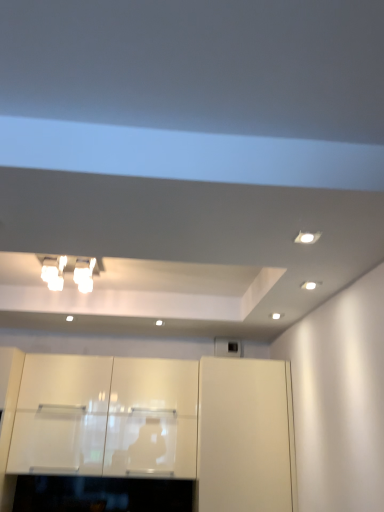
Question: Considering the relative sizes of white glossy light fixture at upper left and glossy white cabinets at center, which is the second cabinetry from left to right, in the image provided, is white glossy light fixture at upper left taller than glossy white cabinets at center, which is the second cabinetry from left to right,?

Choices:
 (A) no
 (B) yes

Answer: (A)

Question: From a real-world perspective, is white glossy light fixture at upper left over glossy white cabinets at center, which is the second cabinetry from left to right?

Choices:
 (A) no
 (B) yes

Answer: (B)

Question: Considering the relative sizes of white glossy light fixture at upper left and glossy white cabinets at center, which is counted as the second cabinetry, starting from the right, in the image provided, is white glossy light fixture at upper left shorter than glossy white cabinets at center, which is counted as the second cabinetry, starting from the right,?

Choices:
 (A) yes
 (B) no

Answer: (A)

Question: Are white glossy light fixture at upper left and glossy white cabinets at center, which is counted as the second cabinetry, starting from the right, located far from each other?

Choices:
 (A) yes
 (B) no

Answer: (A)

Question: Is white glossy light fixture at upper left thinner than glossy white cabinets at center, which is counted as the second cabinetry, starting from the right?

Choices:
 (A) yes
 (B) no

Answer: (B)

Question: Is white glossy cabinet at center, the third cabinetry positioned from the right, bigger or smaller than glossy white cabinets at center, which is the second cabinetry from left to right?

Choices:
 (A) big
 (B) small

Answer: (A)

Question: Which is correct: white glossy cabinet at center, the third cabinetry positioned from the right, is inside glossy white cabinets at center, which is counted as the second cabinetry, starting from the right, or outside of it?

Choices:
 (A) outside
 (B) inside

Answer: (A)

Question: Considering their positions, is white glossy cabinet at center, the third cabinetry positioned from the right, located in front of or behind glossy white cabinets at center, which is the second cabinetry from left to right?

Choices:
 (A) front
 (B) behind

Answer: (B)

Question: Considering the relative positions of white glossy cabinet at center, which is the 1th cabinetry from left to right, and glossy white cabinets at center, which is counted as the second cabinetry, starting from the right, in the image provided, is white glossy cabinet at center, which is the 1th cabinetry from left to right, to the left or to the right of glossy white cabinets at center, which is counted as the second cabinetry, starting from the right,?

Choices:
 (A) right
 (B) left

Answer: (B)

Question: From the image's perspective, is glossy white cabinets at center, which is counted as the second cabinetry, starting from the right, above or below white glossy cabinet at center, which is the 1th cabinetry from left to right?

Choices:
 (A) above
 (B) below

Answer: (A)

Question: Is glossy white cabinets at center, which is the second cabinetry from left to right, bigger or smaller than white glossy cabinet at center, which is the 1th cabinetry from left to right?

Choices:
 (A) small
 (B) big

Answer: (A)

Question: Does point (109, 375) appear closer or farther from the camera than point (64, 382)?

Choices:
 (A) farther
 (B) closer

Answer: (A)

Question: From a real-world perspective, is glossy white cabinets at center, which is the second cabinetry from left to right, physically located above or below white glossy cabinet at center, which is the 1th cabinetry from left to right?

Choices:
 (A) above
 (B) below

Answer: (A)

Question: Is white glossy light fixture at upper left inside or outside of white glossy cabinet at center, positioned as the first cabinetry in right-to-left order?

Choices:
 (A) outside
 (B) inside

Answer: (A)

Question: Looking at their shapes, would you say white glossy light fixture at upper left is wider or thinner than white glossy cabinet at center, the 3th cabinetry in the left-to-right sequence?

Choices:
 (A) wide
 (B) thin

Answer: (B)